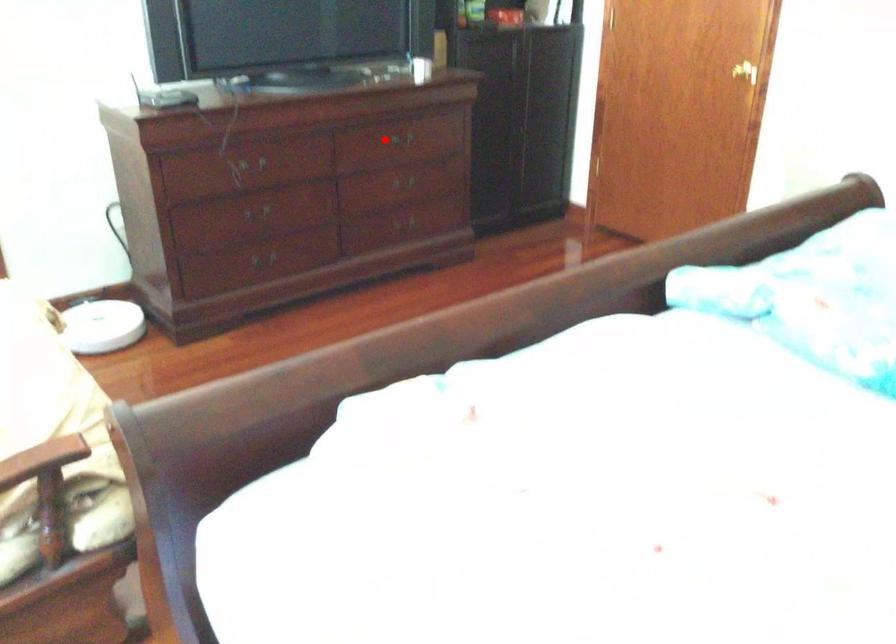
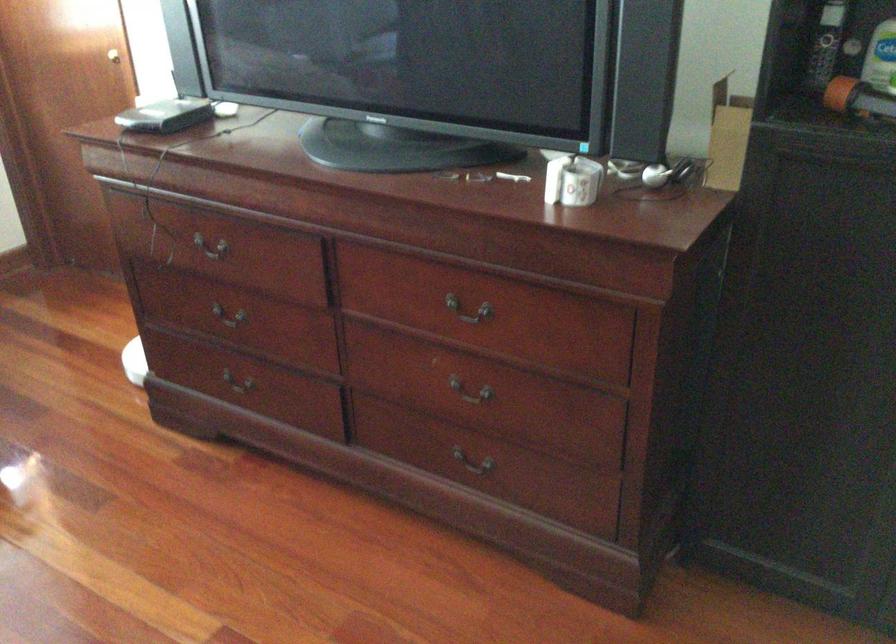
Question: I am providing you with two images of the same scene from different viewpoints. In image1, a red point is highlighted. Considering the same 3D point in image2, which of the following is correct?

Choices:
 (A) It is closer
 (B) It is farther

Answer: (A)